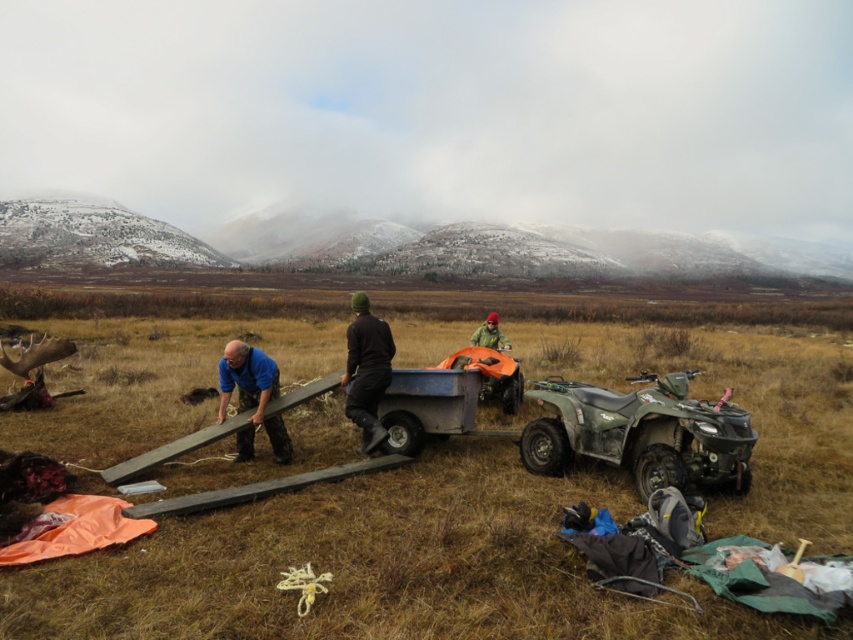
You are a hiker who needs to choose between the black matte jacket at center and the blue fabric shirt at left for a cold evening. Based on their thickness, which one would provide better insulation?

The black matte jacket at center is thinner than the blue fabric shirt at left, so the blue fabric shirt at left would provide better insulation due to its greater thickness.

You are a photographer positioned at the edge of the field. You want to take a photo that includes both the wooden plank at center and the blue fabric shirt at left. Which object should you focus on first to ensure both are in sharp focus?

Since the wooden plank at center is closer to the viewer than the blue fabric shirt at left, you should focus on the wooden plank at center first. This will ensure that both objects are within the depth of field and appear sharp in the photo.